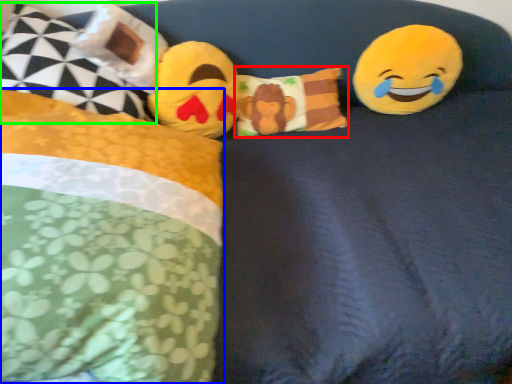
Question: Based on their relative distances, which object is farther from pillow (highlighted by a red box)? Choose from pillow (highlighted by a blue box) and pillow (highlighted by a green box).

Choices:
 (A) pillow
 (B) pillow

Answer: (A)